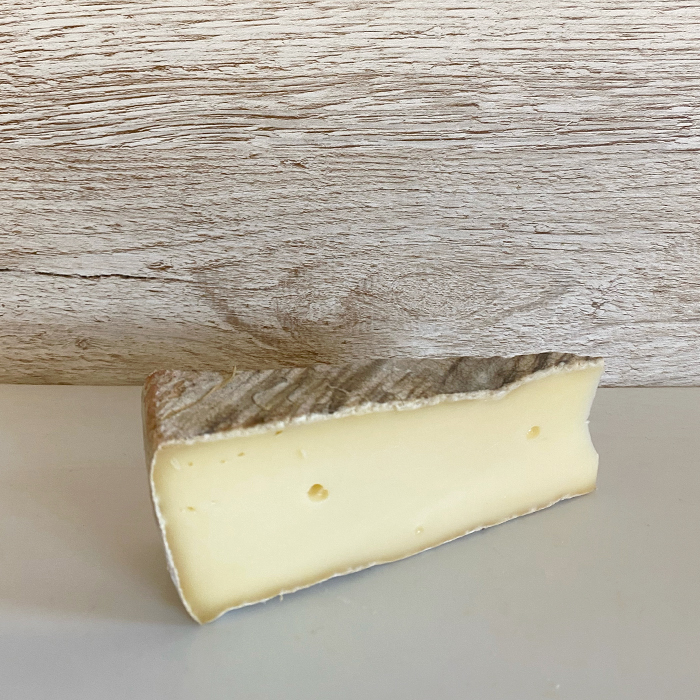
This screenshot has height=700, width=700. Identify the location of wood wall. (556, 237).